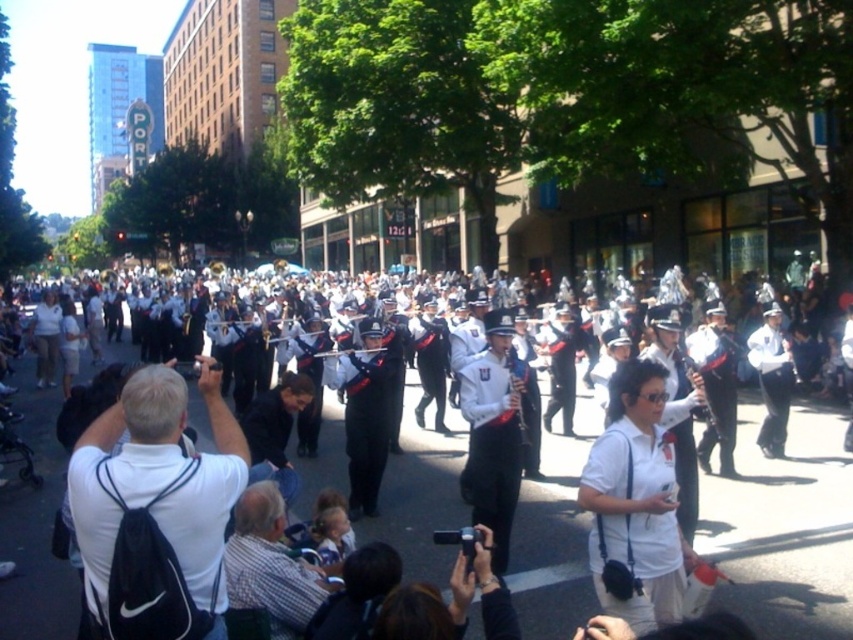
Is plaid shirt at lower center thinner than matte black clarinet at center?

Yes, plaid shirt at lower center is thinner than matte black clarinet at center.

Does plaid shirt at lower center have a lesser height compared to matte black clarinet at center?

No.

I want to click on plaid shirt at lower center, so click(270, 564).

Image resolution: width=853 pixels, height=640 pixels. In order to click on plaid shirt at lower center in this screenshot , I will do `click(270, 564)`.

Based on the photo, does uniformed band at center appear on the left side of white fabric backpack at center?

Yes, uniformed band at center is to the left of white fabric backpack at center.

Which is below, uniformed band at center or white fabric backpack at center?

uniformed band at center

This screenshot has width=853, height=640. In order to click on uniformed band at center in this screenshot , I will do `click(785, 529)`.

Is white fabric backpack at center wider than white matte shirt at center?

No.

Can you confirm if white fabric backpack at center is bigger than white matte shirt at center?

No.

Which is in front, point (219, 416) or point (674, 307)?

Point (219, 416) is more forward.

Image resolution: width=853 pixels, height=640 pixels. In order to click on white fabric backpack at center in this screenshot , I will do `click(91, 467)`.